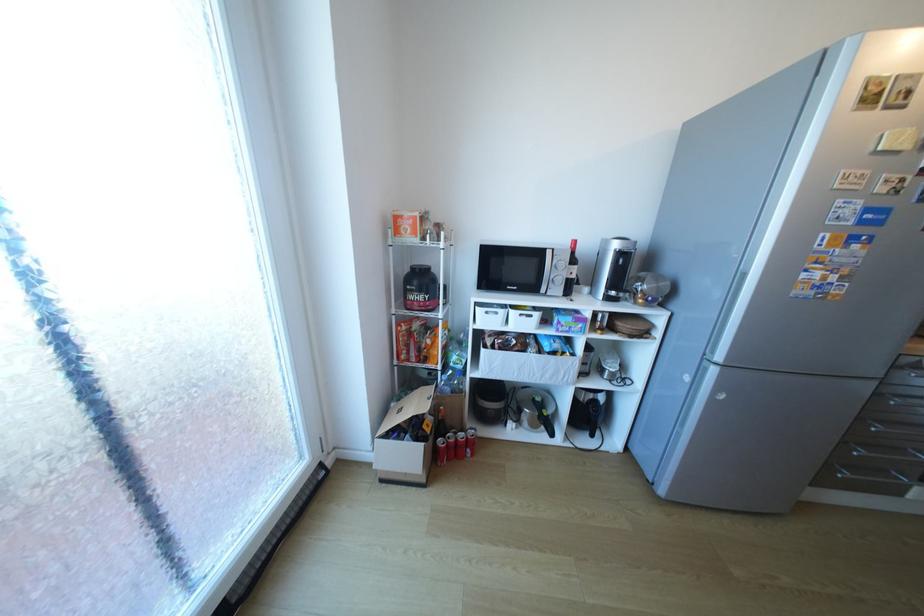
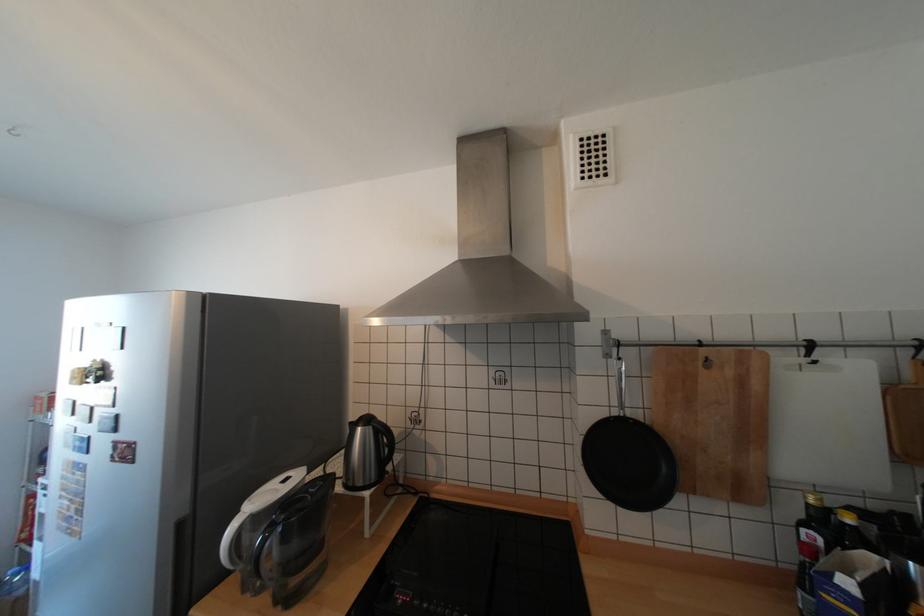
Question: In a continuous first-person perspective shot, in which direction is the camera moving?

Choices:
 (A) Left
 (B) Right
 (C) Forward
 (D) Backward

Answer: (B)